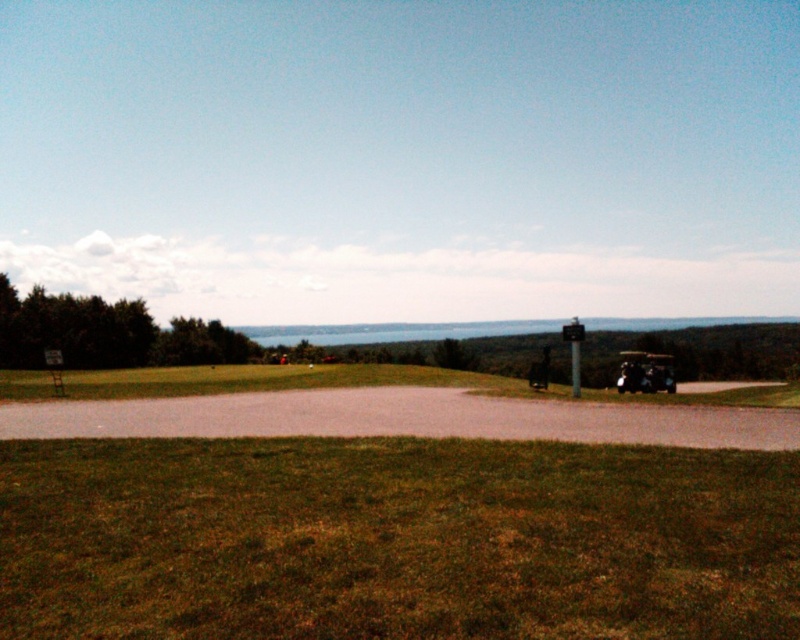
Question: Does green grass at lower center appear over metallic green jeep at lower right?

Choices:
 (A) no
 (B) yes

Answer: (B)

Question: Does green grass at lower center have a larger size compared to metallic green jeep at lower right?

Choices:
 (A) no
 (B) yes

Answer: (A)

Question: Which of the following is the farthest from the observer?

Choices:
 (A) (432, 500)
 (B) (664, 378)

Answer: (B)

Question: Does green grass at lower center appear under metallic green jeep at lower right?

Choices:
 (A) no
 (B) yes

Answer: (A)

Question: Which point is farther from the camera taking this photo?

Choices:
 (A) (334, 625)
 (B) (632, 365)

Answer: (B)